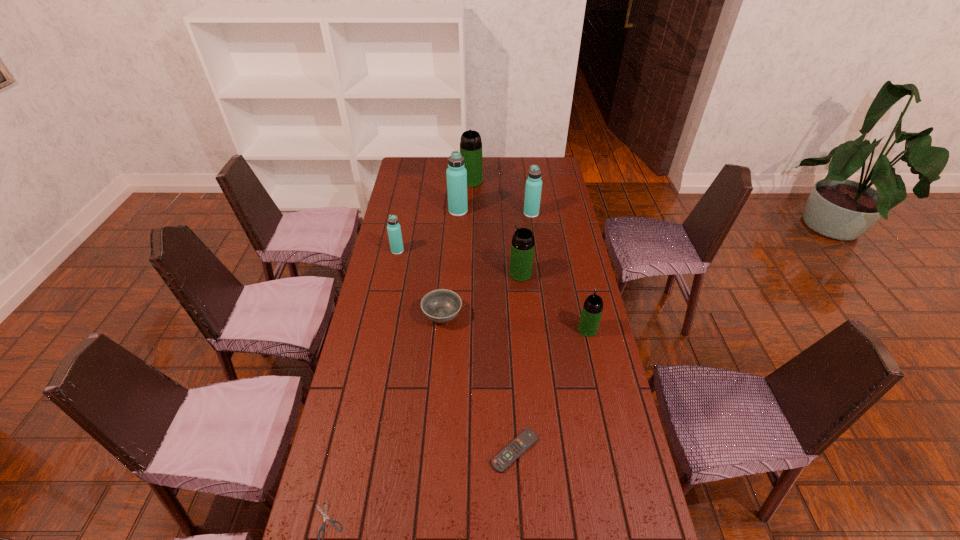
Identify which thermos bottle is the fifth closest to the second smallest aqua thermos bottle. Please provide its 2D coordinates. Your answer should be formatted as a tuple, i.e. [(x, y)], where the tuple contains the x and y coordinates of a point satisfying the conditions above.

[(592, 309)]

You are a GUI agent. You are given a task and a screenshot of the screen. Output one action in this format:
    pyautogui.click(x=<x>, y=<y>)
    Task: Click on the green thermos bottle that is the third nearest to the shortest object
    
    Given the screenshot: What is the action you would take?
    pyautogui.click(x=470, y=144)

At what (x,y) coordinates should I click in order to perform the action: click on the second closest green thermos bottle to the eighth tallest object. Please return your answer as a coordinate pair (x, y). The width and height of the screenshot is (960, 540). Looking at the image, I should click on (522, 247).

I want to click on aqua thermos bottle that is the third closest to the eighth farthest object, so [x=456, y=173].

Select which aqua thermos bottle is the closest to the eighth tallest object. Please provide its 2D coordinates. Your answer should be formatted as a tuple, i.e. [(x, y)], where the tuple contains the x and y coordinates of a point satisfying the conditions above.

[(394, 231)]

Identify the location of free spot that satisfies the following two spatial constraints: 1. from the spout of the rightmost object; 2. from the spout of the second green thermos bottle from left to right. (575, 274).

The width and height of the screenshot is (960, 540). What are the coordinates of `vacant space that satisfies the following two spatial constraints: 1. on the front side of the leftmost aqua thermos bottle; 2. on the left side of the remote control` in the screenshot? It's located at (356, 451).

You are a GUI agent. You are given a task and a screenshot of the screen. Output one action in this format:
    pyautogui.click(x=<x>, y=<y>)
    Task: Click on the vacant space that satisfies the following two spatial constraints: 1. from the spout of the second smallest green thermos bottle; 2. from the spout of the rightmost object
    The image size is (960, 540).
    Given the screenshot: What is the action you would take?
    pyautogui.click(x=526, y=329)

Locate an element on the screen. This screenshot has height=540, width=960. free space in the image that satisfies the following two spatial constraints: 1. from the spout of the rightmost thermos bottle; 2. from the spout of the second smallest green thermos bottle is located at coordinates (575, 274).